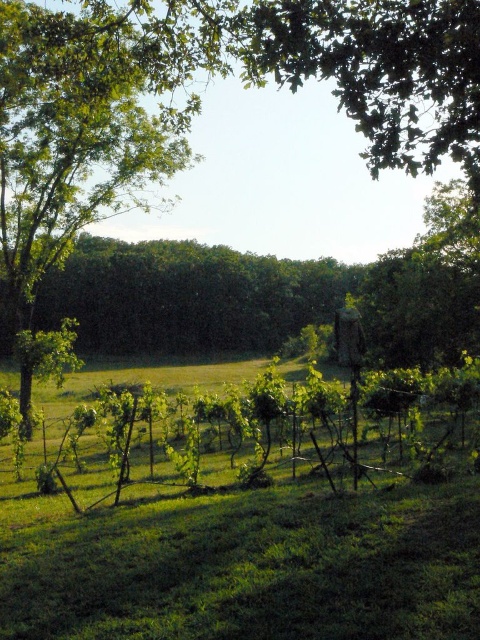
Question: Is green leafy vines at center above green leafy tree at left?

Choices:
 (A) no
 (B) yes

Answer: (A)

Question: Which point is farther to the camera?

Choices:
 (A) (84, 116)
 (B) (58, 534)

Answer: (A)

Question: Which point is closer to the camera?

Choices:
 (A) (31, 205)
 (B) (156, 560)

Answer: (B)

Question: Observing the image, what is the correct spatial positioning of green leafy vines at center in reference to green leafy tree at left?

Choices:
 (A) right
 (B) left

Answer: (A)

Question: Is green leafy vines at center smaller than green leafy tree at left?

Choices:
 (A) yes
 (B) no

Answer: (A)